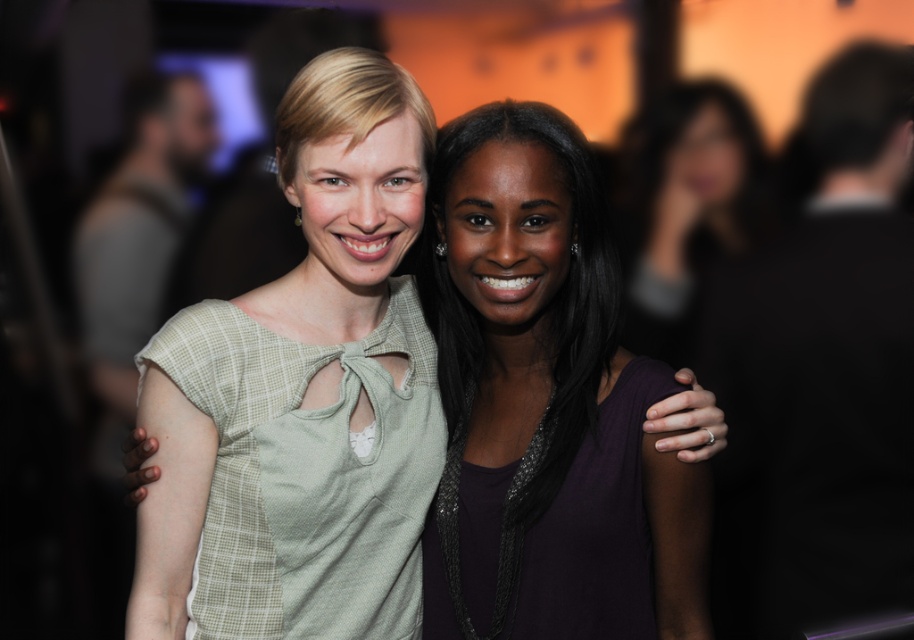
Can you confirm if light green fabric dress at center is positioned below dark purple dress at center?

Indeed, light green fabric dress at center is positioned under dark purple dress at center.

Is light green fabric dress at center above dark purple dress at center?

No.

Image resolution: width=914 pixels, height=640 pixels. In order to click on light green fabric dress at center in this screenshot , I will do `click(344, 195)`.

This screenshot has width=914, height=640. Find the location of `light green fabric dress at center`. light green fabric dress at center is located at coordinates (344, 195).

Looking at this image, who is more forward, (553,234) or (260,589)?

Point (553,234) is in front.

Locate an element on the screen. This screenshot has height=640, width=914. purple matte dress at center is located at coordinates (533, 392).

Can you confirm if purple matte dress at center is thinner than dark purple dress at center?

Indeed, purple matte dress at center has a lesser width compared to dark purple dress at center.

Which is in front, point (476, 420) or point (639, 224)?

Point (476, 420) is in front.

Where is `purple matte dress at center`? The image size is (914, 640). purple matte dress at center is located at coordinates (533, 392).